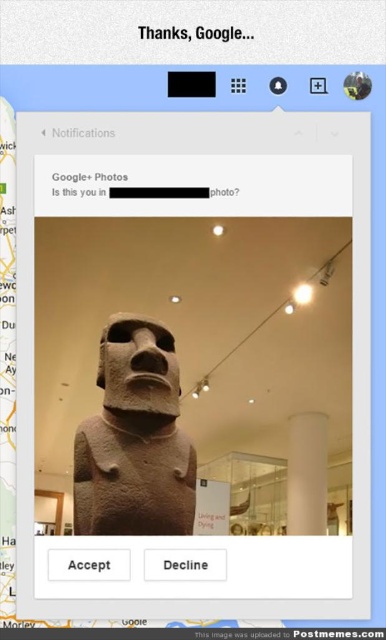
Question: Observing the image, what is the correct spatial positioning of brown stone statue at center in reference to white glossy pillar at right?

Choices:
 (A) left
 (B) right

Answer: (A)

Question: Which object is the closest to the white glossy pillar at right?

Choices:
 (A) white matte website at upper center
 (B) brown stone statue at center

Answer: (B)

Question: Is brown stone statue at center positioned at the back of white matte website at upper center?

Choices:
 (A) yes
 (B) no

Answer: (A)

Question: Among these points, which one is nearest to the camera?

Choices:
 (A) (323, 488)
 (B) (333, 634)
 (C) (167, 456)

Answer: (B)

Question: Is brown stone statue at center bigger than white glossy pillar at right?

Choices:
 (A) yes
 (B) no

Answer: (B)

Question: Estimate the real-world distances between objects in this image. Which object is farther from the white matte website at upper center?

Choices:
 (A) brown stone statue at center
 (B) white glossy pillar at right

Answer: (B)